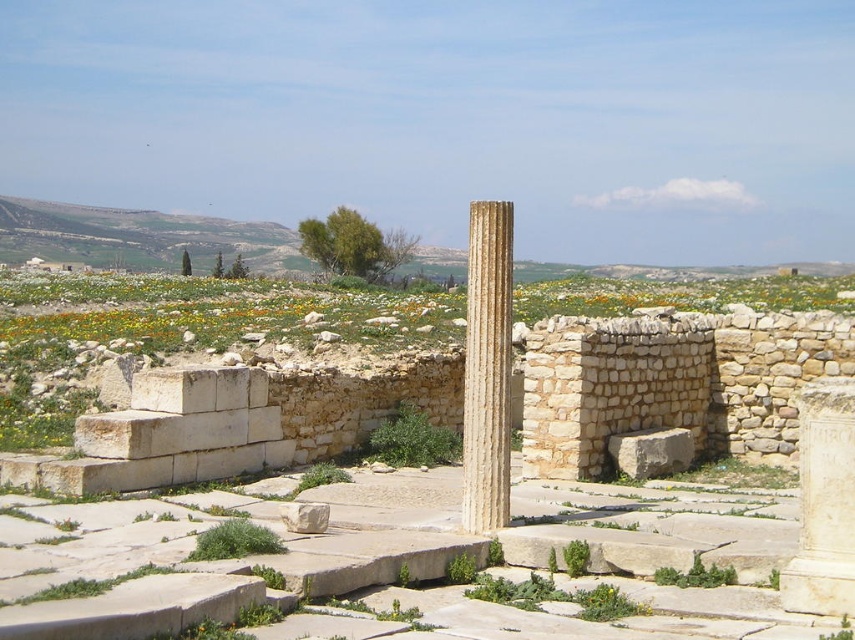
Is beige stone column at center wider than white marble column at right?

No.

Is beige stone column at center positioned at the back of white marble column at right?

Yes, beige stone column at center is behind white marble column at right.

Locate an element on the screen. Image resolution: width=855 pixels, height=640 pixels. beige stone column at center is located at coordinates (487, 368).